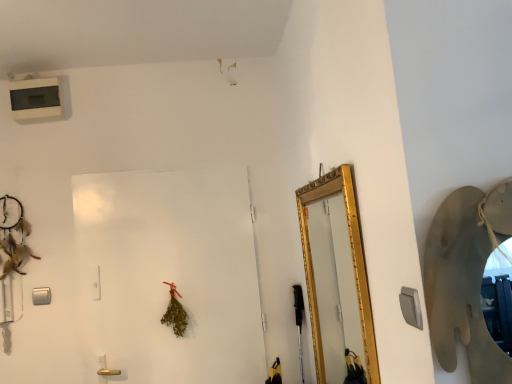
The image size is (512, 384). Describe the element at coordinates (334, 285) in the screenshot. I see `gold/gilded mirror at right` at that location.

Image resolution: width=512 pixels, height=384 pixels. In order to click on gold/gilded mirror at right in this screenshot , I will do `click(334, 285)`.

Measure the distance between point (336,207) and camera.

They are 6.83 feet apart.

You are a GUI agent. You are given a task and a screenshot of the screen. Output one action in this format:
    pyautogui.click(x=<x>, y=<y>)
    Task: Click on the gold/gilded mirror at right
    
    Given the screenshot: What is the action you would take?
    pyautogui.click(x=334, y=285)